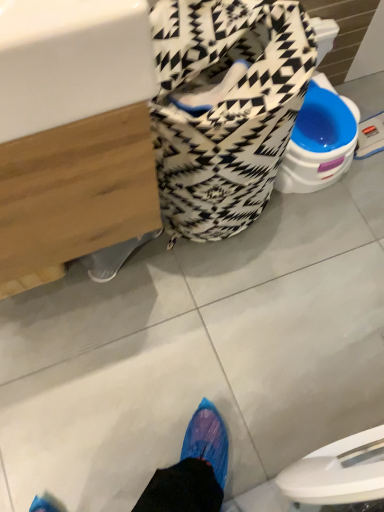
The width and height of the screenshot is (384, 512). Find the location of `vacant region in front of white glossy sink at upper left`. vacant region in front of white glossy sink at upper left is located at coordinates (85, 382).